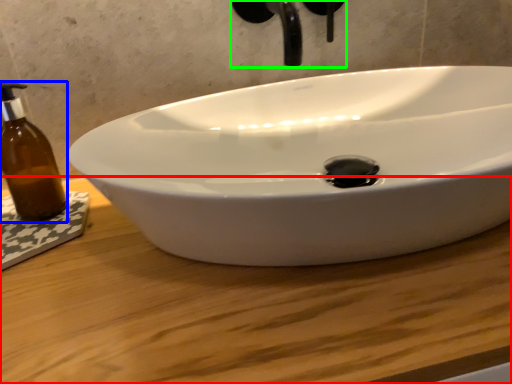
Question: Considering the real-world distances, which object is closest to counter top (highlighted by a red box)? bottle (highlighted by a blue box) or plumbing fixture (highlighted by a green box).

Choices:
 (A) bottle
 (B) plumbing fixture

Answer: (A)